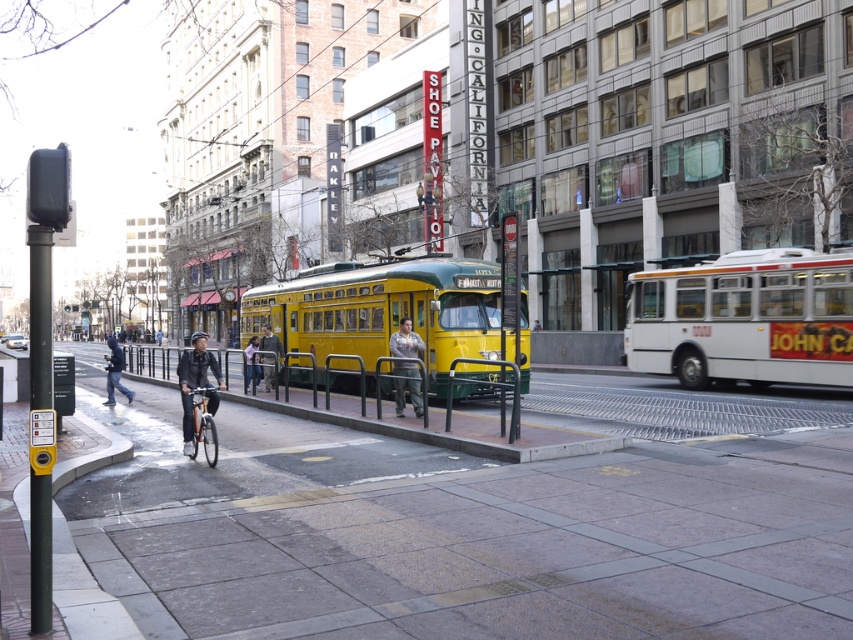
Question: Based on their relative distances, which object is nearer to the concrete sidewalk at center?

Choices:
 (A) camouflage pants at center
 (B) white matte bus at right

Answer: (A)

Question: Which object is positioned closest to the yellow matte trolley at center?

Choices:
 (A) camouflage pants at center
 (B) light blue jeans at center
 (C) white matte bus at right
 (D) gray fabric jacket at center

Answer: (B)

Question: Does concrete sidewalk at center have a lesser width compared to orange metallic bicycle at lower left?

Choices:
 (A) no
 (B) yes

Answer: (A)

Question: Can you confirm if white matte bus at right is positioned below light blue jeans at center?

Choices:
 (A) yes
 (B) no

Answer: (B)

Question: Among these objects, which one is farthest from the camera?

Choices:
 (A) gray fabric jacket at center
 (B) camouflage pants at center

Answer: (B)

Question: Is yellow matte trolley at center wider than orange metallic bicycle at lower left?

Choices:
 (A) yes
 (B) no

Answer: (A)